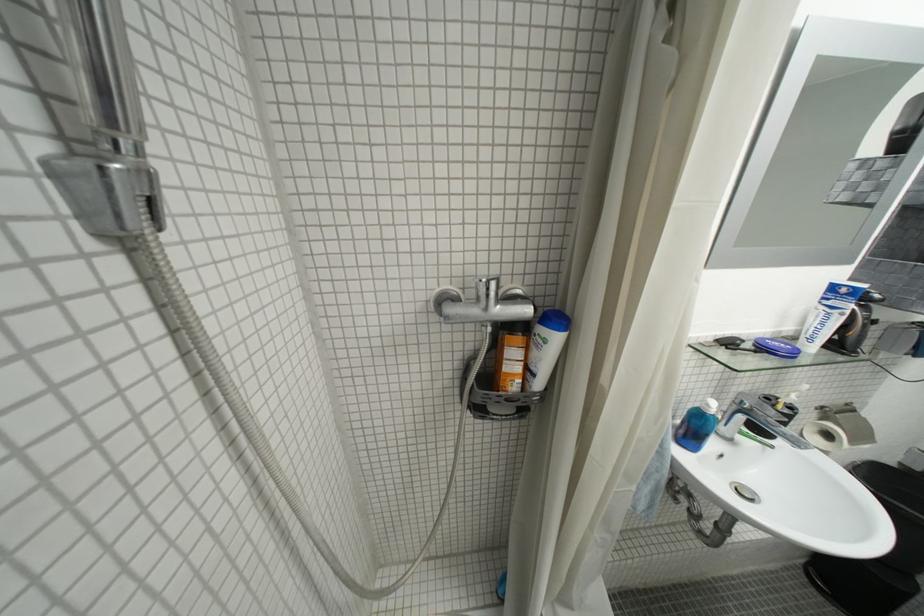
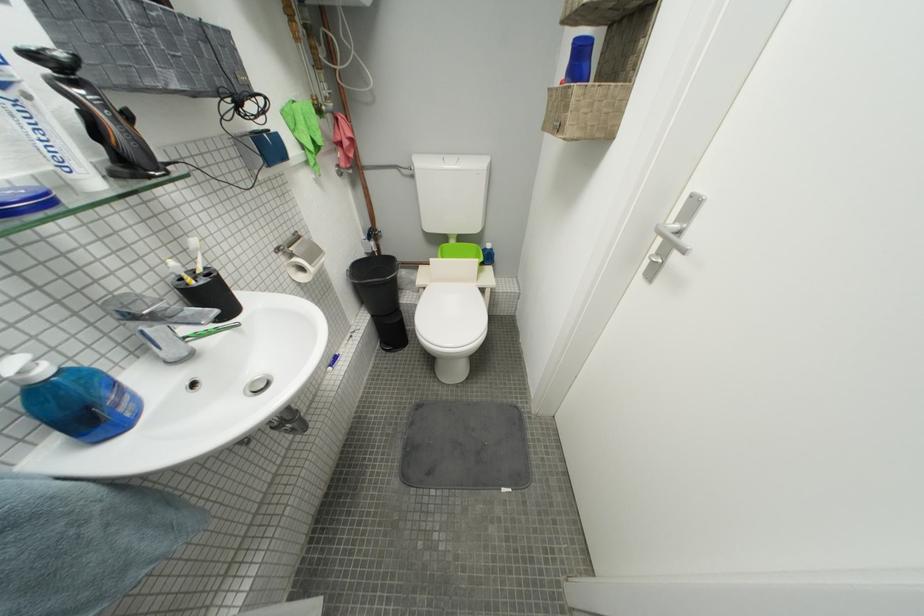
Find the pixel in the second image that matches the point at 820,350 in the first image.

(103, 185)